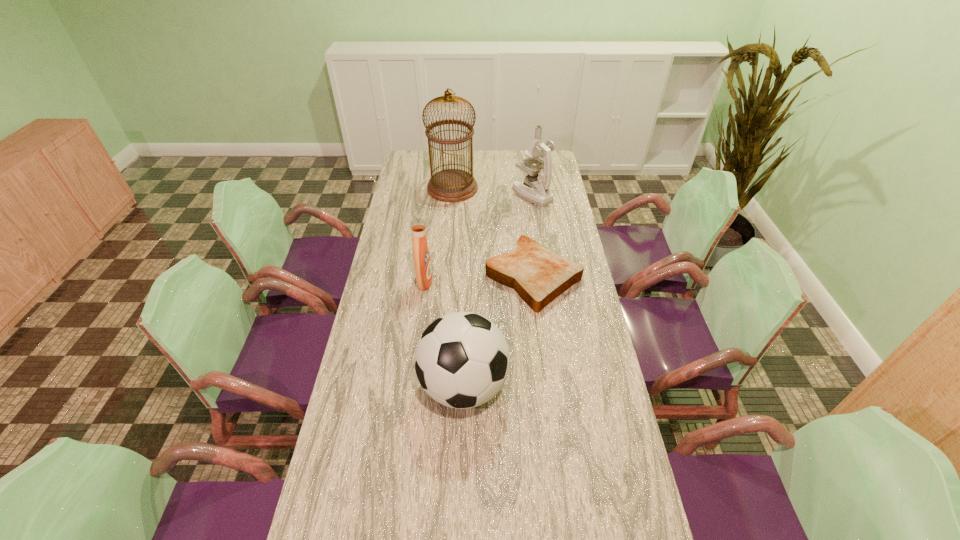
Where is `object that is the third nearest to the tallest object`? This screenshot has height=540, width=960. object that is the third nearest to the tallest object is located at coordinates (422, 263).

Identify which object is the third nearest to the detergent. Please provide its 2D coordinates. Your answer should be formatted as a tuple, i.e. [(x, y)], where the tuple contains the x and y coordinates of a point satisfying the conditions above.

[(451, 185)]

You are a GUI agent. You are given a task and a screenshot of the screen. Output one action in this format:
    pyautogui.click(x=<x>, y=<y>)
    Task: Click on the free space that satisfies the following two spatial constraints: 1. on the front-facing side of the fourth shortest object; 2. on the left side of the tallest object
    Image resolution: width=960 pixels, height=540 pixels.
    Given the screenshot: What is the action you would take?
    pyautogui.click(x=452, y=194)

At what (x,y) coordinates should I click in order to perform the action: click on free space that satisfies the following two spatial constraints: 1. on the front-facing side of the nearest object; 2. on the left side of the detergent. Please return your answer as a coordinate pair (x, y). This screenshot has width=960, height=540. Looking at the image, I should click on (411, 386).

Locate an element on the screen. free space that satisfies the following two spatial constraints: 1. on the front-facing side of the birdcage; 2. on the left side of the bread is located at coordinates (445, 276).